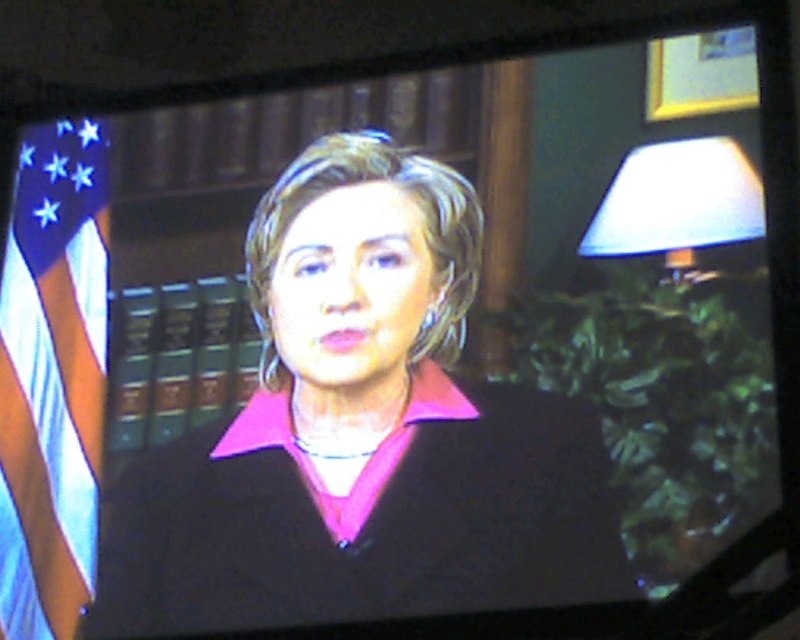
You are an interior designer planning to rearrange the items in the room shown. You need to place a new decorative item between the blue fabric flag at left and the white fabric lampshade at upper right. Based on their positions, where should you position this new item?

The blue fabric flag at left is located below the white fabric lampshade at upper right, so the new decorative item should be placed between them in the vertical space between the blue fabric flag at left and the white fabric lampshade at upper right.

You are a photographer setting up for a video call. You need to position your camera so that both the blue fabric flag at left and the white fabric lampshade at upper right are visible in the frame. Given their distance apart, can you estimate if they will both fit within a standard smartphone camera frame that has a 60 degree field of view?

The blue fabric flag at left and white fabric lampshade at upper right are 3.07 meters apart. With a 60 degree field of view, a standard smartphone camera can capture objects up to approximately 3 meters apart at typical shooting distances. Therefore, both the blue fabric flag at left and white fabric lampshade at upper right should fit within the frame.